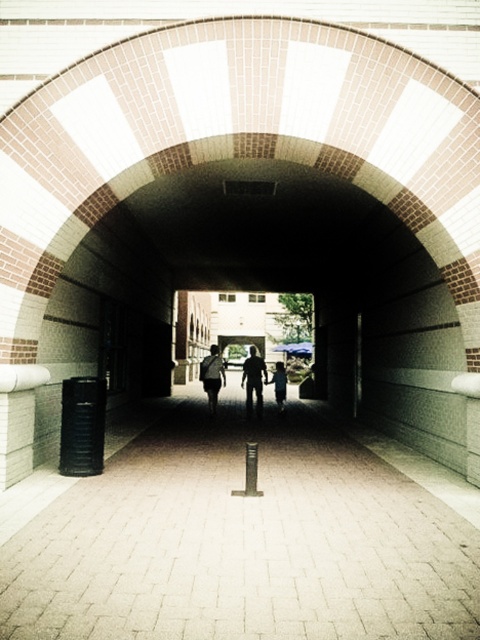
You are standing at the entrance of the tunnel and see the brick pavement at center and the dark gray fabric jacket at center. Which object is closer to the ground?

The brick pavement at center is closer to the ground since it has a lesser height compared to the dark gray fabric jacket at center.

You are standing at the entrance of the tunnel and want to reach the bright opening at the far end. You have a dark gray fabric jacket at center and a brick pavement at center in your path. How far apart are these two objects from each other?

The brick pavement at center is 5.15 meters away from the dark gray fabric jacket at center.